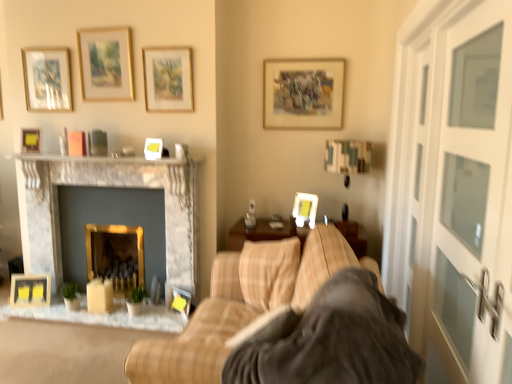
At what (x,y) coordinates should I click in order to perform the action: click on vacant area that lies in front of matte black picture frame at lower center, the 8th picture frame positioned from the left. Please return your answer as a coordinate pair (x, y). This screenshot has width=512, height=384. Looking at the image, I should click on (170, 319).